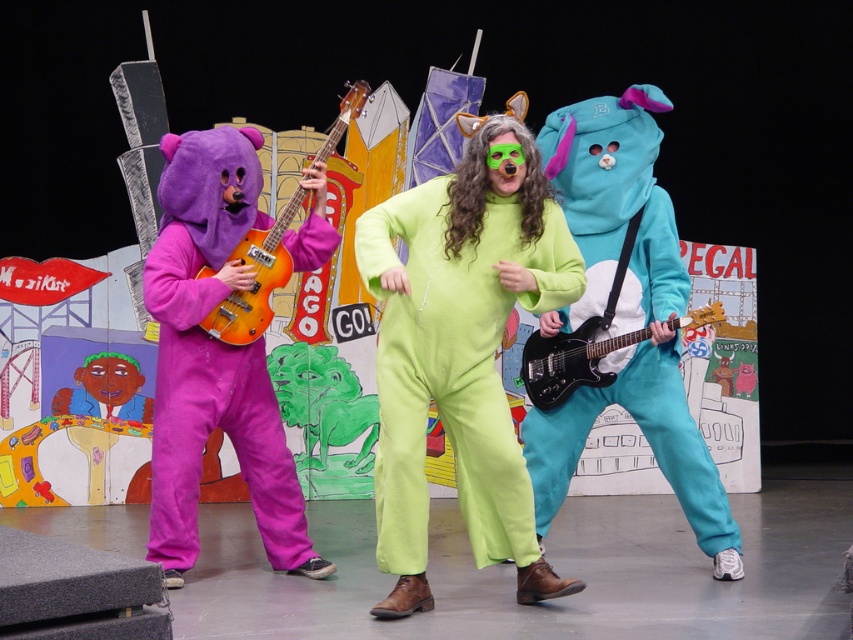
You are an audience member sitting in the front row of the stage. You want to take a photo of both the green fleece jumpsuit at center and the black glossy electric guitar at center. Which one will appear larger in your photo?

The green fleece jumpsuit at center will appear larger in the photo because it is closer to the viewer than the black glossy electric guitar at center.

You are a stagehand who needs to position a 40 inch wide banner between the green fleece jumpsuit at center and the purple fleece bear at left. Can you fit the banner between them without moving either performer?

The distance between the green fleece jumpsuit at center and the purple fleece bear at left is 38.50 inches. Since the banner is 40 inches wide, it cannot fit between them without moving the performers as the space is narrower than the banner.

You are a stagehand setting up the stage for the performance. You need to ensure that the purple fleece bear at left and the orange glossy guitar at left are positioned so that the bear doesn not block the guitar. Given their sizes, which object should be placed closer to the front of the stage?

The purple fleece bear at left occupies less space than orange glossy guitar at left, so placing the purple fleece bear at left closer to the front will prevent it from blocking the larger guitar.